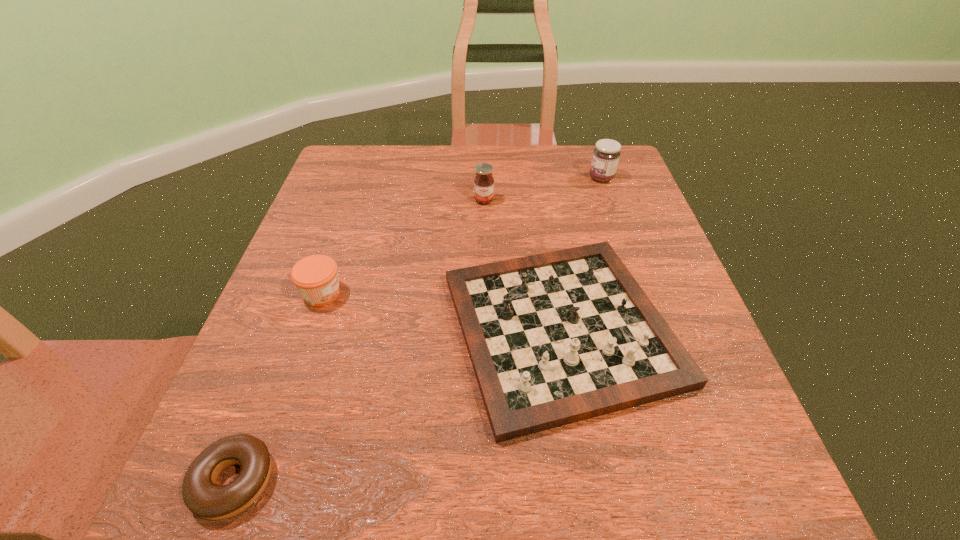
The image size is (960, 540). Identify the location of free spot between the chessboard and the nearest jam. (442, 311).

Find the location of a particular element. This screenshot has height=540, width=960. free space between the shortest object and the second farthest object is located at coordinates (359, 340).

Where is `free space between the second nearest jam and the rightmost jam`? This screenshot has width=960, height=540. free space between the second nearest jam and the rightmost jam is located at coordinates (542, 189).

Find the location of `free space between the farthest object and the fourth nearest object`. free space between the farthest object and the fourth nearest object is located at coordinates (542, 189).

Locate an element on the screen. This screenshot has width=960, height=540. empty location between the chessboard and the shortest jam is located at coordinates (442, 311).

What are the coordinates of `empty space between the chessboard and the shortest jam` in the screenshot? It's located at 442,311.

This screenshot has height=540, width=960. Find the location of `free space that is in between the fourth nearest object and the farthest jam`. free space that is in between the fourth nearest object and the farthest jam is located at coordinates (542, 189).

Identify which object is the fourth nearest to the chessboard. Please provide its 2D coordinates. Your answer should be formatted as a tuple, i.e. [(x, y)], where the tuple contains the x and y coordinates of a point satisfying the conditions above.

[(606, 154)]

Select which object is the third closest to the second nearest jam. Please provide its 2D coordinates. Your answer should be formatted as a tuple, i.e. [(x, y)], where the tuple contains the x and y coordinates of a point satisfying the conditions above.

[(315, 276)]

You are a GUI agent. You are given a task and a screenshot of the screen. Output one action in this format:
    pyautogui.click(x=<x>, y=<y>)
    Task: Click on the jam object that ranks as the closest to the leftmost jam
    
    Given the screenshot: What is the action you would take?
    pyautogui.click(x=484, y=182)